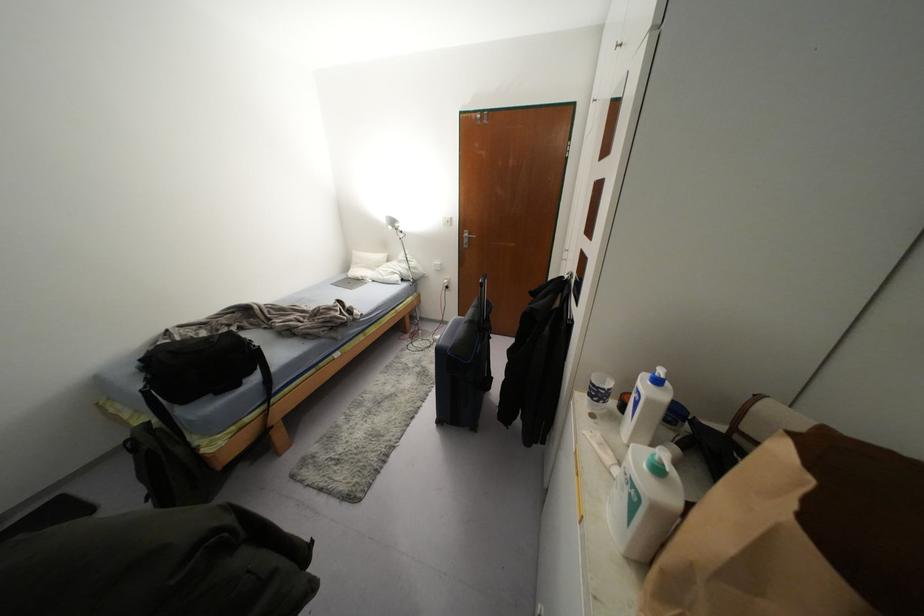
Where is `suitcase handle`? This screenshot has width=924, height=616. suitcase handle is located at coordinates (482, 276).